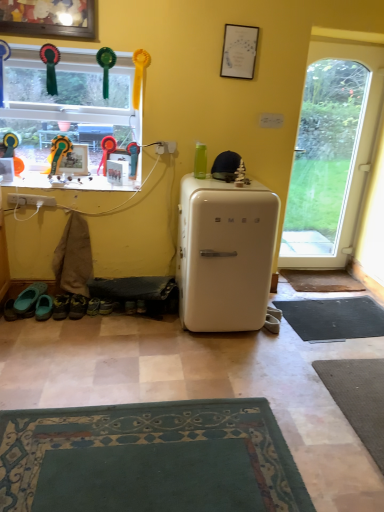
At what (x,y) coordinates should I click in order to perform the action: click on blank space situated above black rubber doormat at lower right (from a real-world perspective). Please return your answer as a coordinate pair (x, y). The image size is (384, 512). Looking at the image, I should click on (336, 316).